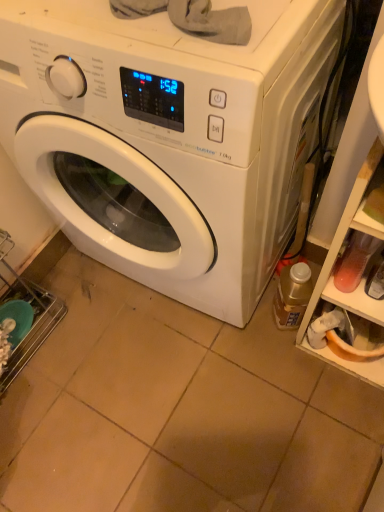
This screenshot has height=512, width=384. What do you see at coordinates (347, 232) in the screenshot?
I see `translucent plastic shelf at right` at bounding box center [347, 232].

I want to click on translucent plastic bottle at lower right, so click(x=292, y=295).

Locate an element on the screen. white glossy washing machine at center is located at coordinates tap(169, 137).

Looking at their sizes, would you say white glossy washing machine at center is wider or thinner than translucent plastic bottle at lower right?

In the image, white glossy washing machine at center appears to be wider than translucent plastic bottle at lower right.

Does white glossy washing machine at center have a lesser height compared to translucent plastic bottle at lower right?

Incorrect, the height of white glossy washing machine at center does not fall short of that of translucent plastic bottle at lower right.

Does white glossy washing machine at center touch translucent plastic bottle at lower right?

white glossy washing machine at center and translucent plastic bottle at lower right are not in contact.

This screenshot has width=384, height=512. What are the coordinates of `bottle below the white glossy washing machine at center (from the image's perspective)` in the screenshot? It's located at (292, 295).

Would you say white glossy washing machine at center is part of translucent plastic shelf at right's contents?

No, white glossy washing machine at center is not a part of translucent plastic shelf at right.

Can you confirm if translucent plastic shelf at right is positioned to the right of white glossy washing machine at center?

Correct, you'll find translucent plastic shelf at right to the right of white glossy washing machine at center.

Is translucent plastic shelf at right positioned far away from white glossy washing machine at center?

That's not correct — translucent plastic shelf at right is a little close to white glossy washing machine at center.

Who is shorter, translucent plastic shelf at right or white glossy washing machine at center?

translucent plastic shelf at right.

Would you say white glossy washing machine at center is a long distance from translucent plastic shelf at right?

No, white glossy washing machine at center is not far from translucent plastic shelf at right.

Considering the positions of objects white glossy washing machine at center and translucent plastic shelf at right in the image provided, who is more to the left, white glossy washing machine at center or translucent plastic shelf at right?

From the viewer's perspective, white glossy washing machine at center appears more on the left side.

Which is in front, white glossy washing machine at center or translucent plastic shelf at right?

white glossy washing machine at center is closer to the camera.

Is white glossy washing machine at center facing away from translucent plastic shelf at right?

No, white glossy washing machine at center's orientation is not away from translucent plastic shelf at right.

Considering the relative positions of translucent plastic bottle at lower right and translucent plastic shelf at right in the image provided, is translucent plastic bottle at lower right to the left of translucent plastic shelf at right from the viewer's perspective?

Yes.

Measure the distance between translucent plastic bottle at lower right and translucent plastic shelf at right.

translucent plastic bottle at lower right and translucent plastic shelf at right are 6.76 inches apart.

Can you confirm if translucent plastic bottle at lower right is taller than translucent plastic shelf at right?

Incorrect, the height of translucent plastic bottle at lower right is not larger of that of translucent plastic shelf at right.

Is translucent plastic bottle at lower right far away from translucent plastic shelf at right?

They are positioned close to each other.

Between translucent plastic bottle at lower right and white glossy washing machine at center, which one has larger width?

white glossy washing machine at center.

Is translucent plastic bottle at lower right in front of or behind white glossy washing machine at center in the image?

Clearly, translucent plastic bottle at lower right is behind white glossy washing machine at center.

Is point (304, 294) positioned before point (186, 85)?

No, it is behind (186, 85).

Can you tell me how much translucent plastic shelf at right and translucent plastic bottle at lower right differ in facing direction?

50.9 degrees.

Does point (357, 342) come closer to viewer compared to point (294, 293)?

No, it is not.

Could you tell me if translucent plastic shelf at right is facing translucent plastic bottle at lower right?

No, translucent plastic shelf at right is not facing towards translucent plastic bottle at lower right.

Which object is further away from the camera, translucent plastic shelf at right or translucent plastic bottle at lower right?

translucent plastic bottle at lower right is more distant.

You are a GUI agent. You are given a task and a screenshot of the screen. Output one action in this format:
    pyautogui.click(x=<x>, y=<y>)
    Task: Click on the bottle on the right of white glossy washing machine at center
    The image size is (384, 512).
    Given the screenshot: What is the action you would take?
    pyautogui.click(x=292, y=295)

This screenshot has width=384, height=512. Identify the location of shelf below the white glossy washing machine at center (from a real-world perspective). (347, 232).

Which object lies nearer to the anchor point translucent plastic bottle at lower right, white glossy washing machine at center or translucent plastic shelf at right?

A: Among the two, translucent plastic shelf at right is located nearer to translucent plastic bottle at lower right.

When comparing their distances from white glossy washing machine at center, does translucent plastic bottle at lower right or translucent plastic shelf at right seem further?

Among the two, translucent plastic bottle at lower right is located further to white glossy washing machine at center.

Based on their spatial positions, is translucent plastic shelf at right or translucent plastic bottle at lower right closer to white glossy washing machine at center?

translucent plastic shelf at right is positioned closer to the anchor white glossy washing machine at center.

Considering their positions, is translucent plastic shelf at right positioned further to translucent plastic bottle at lower right than white glossy washing machine at center?

white glossy washing machine at center.

Based on the photo, looking at the image, which one is located further to translucent plastic shelf at right, white glossy washing machine at center or translucent plastic bottle at lower right?

white glossy washing machine at center.

Based on their spatial positions, is translucent plastic bottle at lower right or white glossy washing machine at center further from translucent plastic shelf at right?

white glossy washing machine at center lies further to translucent plastic shelf at right than the other object.

You are a GUI agent. You are given a task and a screenshot of the screen. Output one action in this format:
    pyautogui.click(x=<x>, y=<y>)
    Task: Click on the shelf between white glossy washing machine at center and translucent plastic bottle at lower right in the front-back direction
    
    Given the screenshot: What is the action you would take?
    pyautogui.click(x=347, y=232)